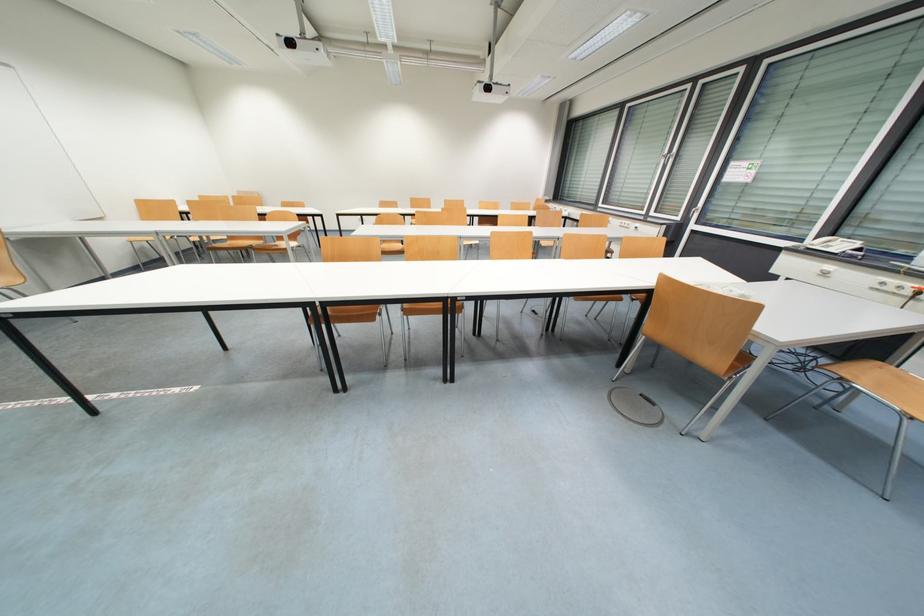
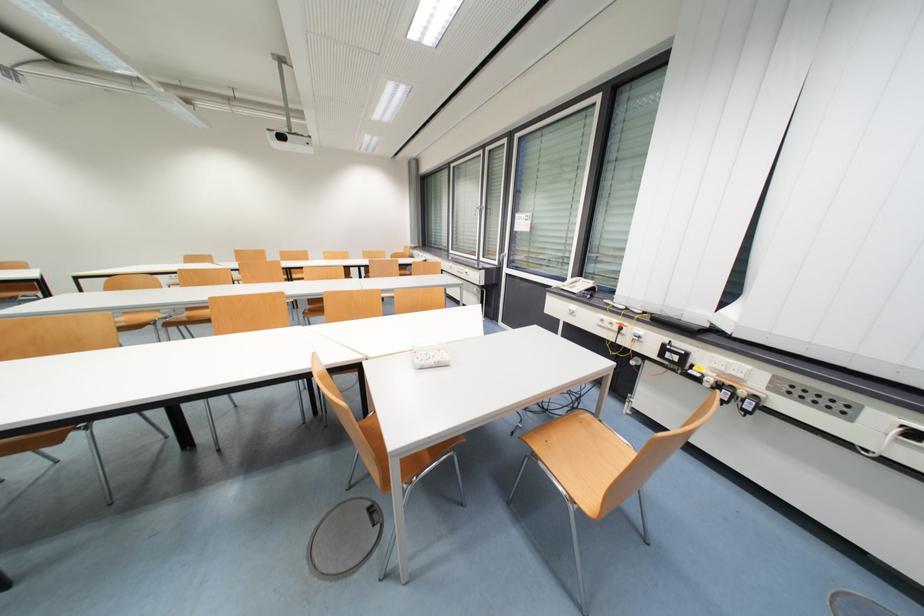
The point at (493, 90) is marked in the first image. Where is the corresponding point in the second image?

(286, 139)